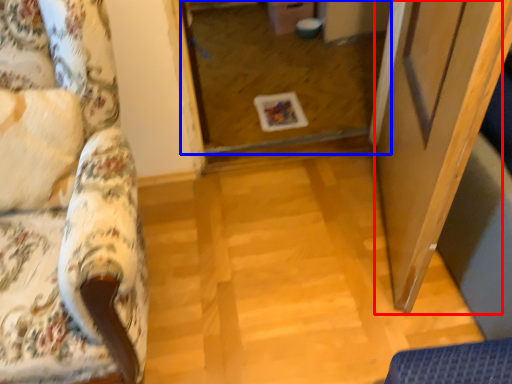
Question: Which of the following is the farthest to the observer, screen door (highlighted by a red box) or glass door (highlighted by a blue box)?

Choices:
 (A) screen door
 (B) glass door

Answer: (B)